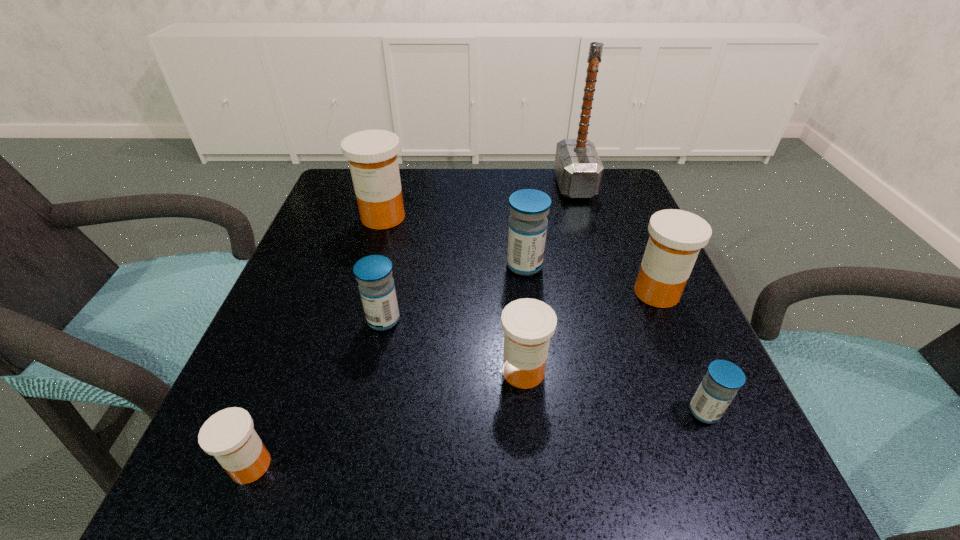
Image resolution: width=960 pixels, height=540 pixels. Identify the location of unoccupied area between the seventh farthest object and the smallest orange medicine. (477, 438).

This screenshot has height=540, width=960. Identify the location of unoccupied area between the second smallest orange medicine and the brown hammer. click(x=549, y=278).

Find the location of a particular element. The width and height of the screenshot is (960, 540). vacant area between the third orange medicine from left to right and the second nearest blue medicine is located at coordinates (453, 346).

This screenshot has width=960, height=540. In order to click on free space that is in between the biggest blue medicine and the nearest orange medicine in this screenshot , I will do `click(388, 365)`.

This screenshot has height=540, width=960. Find the location of `free area in between the nearest object and the third smallest orange medicine`. free area in between the nearest object and the third smallest orange medicine is located at coordinates (454, 379).

The width and height of the screenshot is (960, 540). Find the location of `vacant space that is in between the third nearest medicine and the seventh shortest object`. vacant space that is in between the third nearest medicine and the seventh shortest object is located at coordinates (453, 294).

The width and height of the screenshot is (960, 540). I want to click on free area in between the smallest orange medicine and the second farthest blue medicine, so click(317, 393).

Identify the location of free space between the farthest object and the nearest medicine. (413, 325).

Locate an element on the screen. free area in between the third orange medicine from left to right and the sixth farthest medicine is located at coordinates (613, 392).

Find the location of a particular element. The width and height of the screenshot is (960, 540). object that can be found as the fourth closest to the third smallest orange medicine is located at coordinates (578, 168).